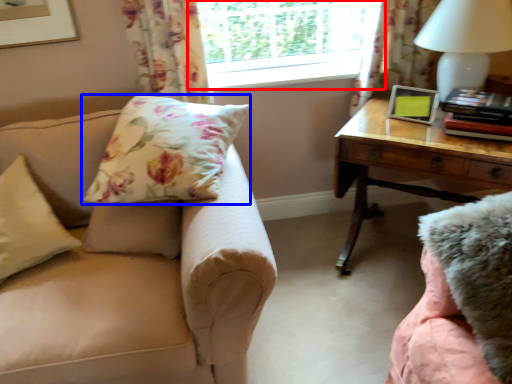
Question: Which object is closer to the camera taking this photo, window (highlighted by a red box) or pillow (highlighted by a blue box)?

Choices:
 (A) window
 (B) pillow

Answer: (B)